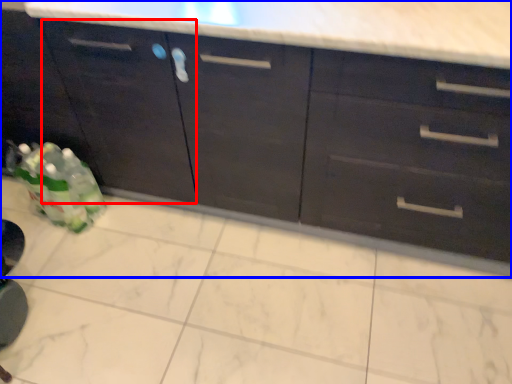
Question: Which point is closer to the camera, cabinetry (highlighted by a red box) or cabinetry (highlighted by a blue box)?

Choices:
 (A) cabinetry
 (B) cabinetry

Answer: (B)